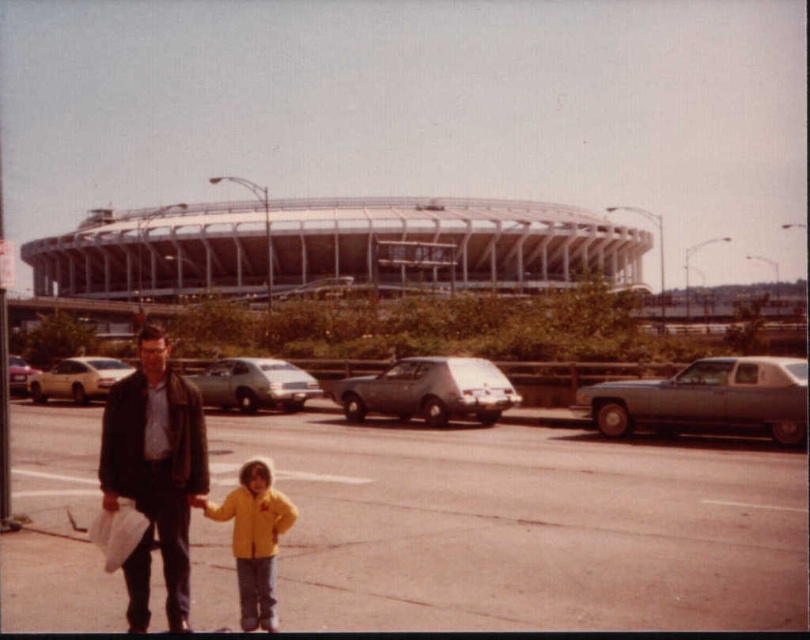
Question: Which object is the farthest from the silver metallic sedan at center?

Choices:
 (A) leather jacket at left
 (B) metallic silver sedan at right
 (C) white matte sedan at center

Answer: (A)

Question: Does metallic silver sedan at right appear under matte silver sedan at left?

Choices:
 (A) yes
 (B) no

Answer: (A)

Question: Is yellow matte jacket at center bigger than white matte sedan at center?

Choices:
 (A) no
 (B) yes

Answer: (A)

Question: Which point is closer to the camera taking this photo?

Choices:
 (A) (250, 541)
 (B) (105, 448)
 (C) (65, 388)
 (D) (489, 410)

Answer: (A)

Question: Which point is closer to the camera?

Choices:
 (A) silver metallic hatchback at center
 (B) matte silver sedan at left
 (C) silver metallic sedan at center

Answer: (B)

Question: Does metallic silver sedan at right have a smaller size compared to matte silver sedan at left?

Choices:
 (A) yes
 (B) no

Answer: (A)